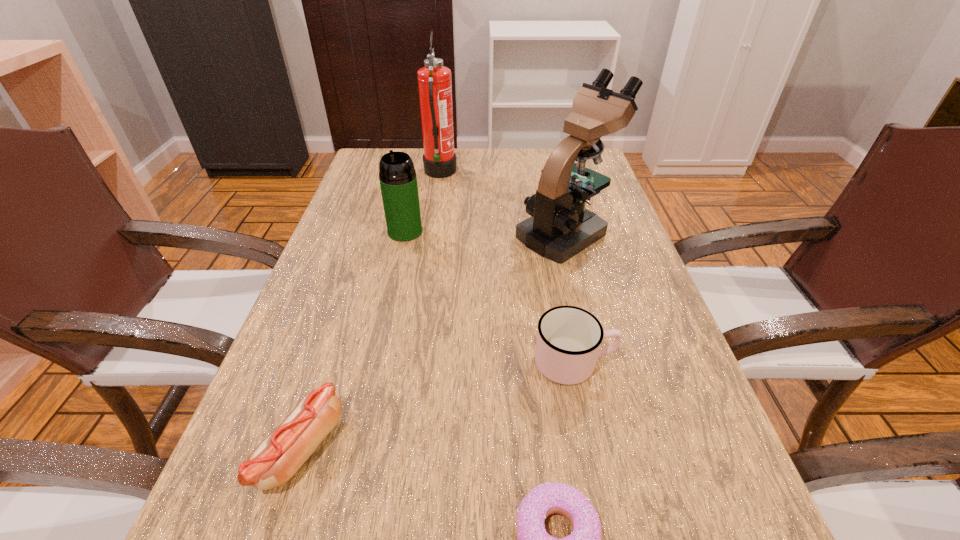
Where is `free space that is in between the fifth tallest object and the microscope`? Image resolution: width=960 pixels, height=540 pixels. free space that is in between the fifth tallest object and the microscope is located at coordinates (434, 341).

Identify the location of unoccupied area between the sausage and the fourth tallest object. (438, 406).

The width and height of the screenshot is (960, 540). What are the coordinates of `empty space that is in between the fourth tallest object and the fire extinguisher` in the screenshot? It's located at (507, 268).

Locate an element on the screen. The image size is (960, 540). vacant area that lies between the fire extinguisher and the microscope is located at coordinates (503, 203).

Identify the location of vacant space that is in between the sausage and the microscope. (434, 341).

In order to click on blank region between the fire extinguisher and the microscope in this screenshot , I will do `click(503, 203)`.

You are a GUI agent. You are given a task and a screenshot of the screen. Output one action in this format:
    pyautogui.click(x=<x>, y=<y>)
    Task: Click on the fifth closest object to the microscope
    
    Given the screenshot: What is the action you would take?
    pyautogui.click(x=548, y=498)

Where is `the third closest object relative to the thermos bottle`? This screenshot has height=540, width=960. the third closest object relative to the thermos bottle is located at coordinates (568, 341).

Identify the location of vacant space that satisfies the following two spatial constraints: 1. from the spout of the microscope; 2. on the right side of the fourth shortest object. (405, 233).

Locate an element on the screen. The height and width of the screenshot is (540, 960). vacant space that satisfies the following two spatial constraints: 1. on the front side of the microscope; 2. on the side of the third shortest object with the handle is located at coordinates (598, 362).